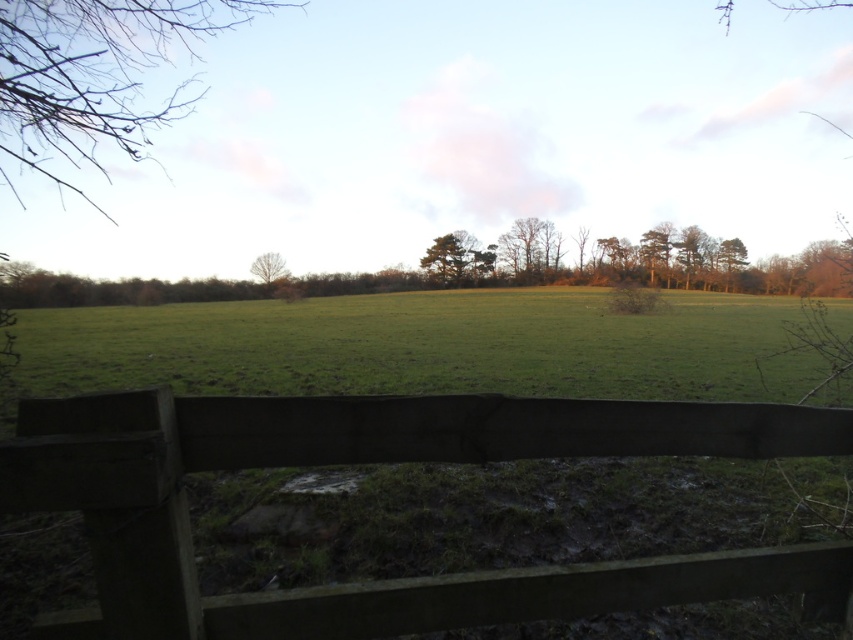
You are standing in the rural landscape and want to walk towards the horizon. Which direction should you move relative to the dark brown wooden fence at lower center?

To walk towards the horizon, you should move away from the dark brown wooden fence at lower center, as the field beyond it extends towards the horizon.

You are a painter standing in the field and want to paint the dark brown wooden fence at lower center and the bare branches at upper left. Which object is closer to the ground?

The dark brown wooden fence at lower center is closer to the ground than the bare branches at upper left because it is shorter than them.

You are standing in the field and see the dark brown wooden fence at lower center and the bare branches at upper left. Which object is closer to the ground?

The dark brown wooden fence at lower center is closer to the ground because it is positioned below the bare branches at upper left.